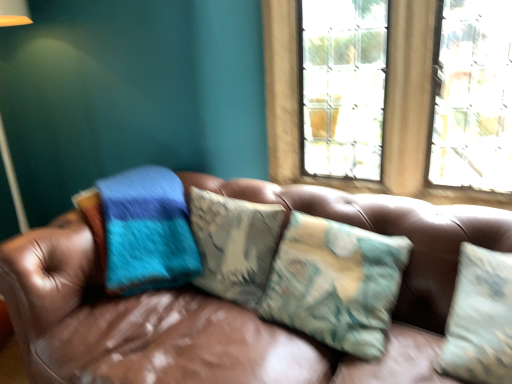
Question: From a real-world perspective, is camouflage fabric pillow at center on top of clear glass window at upper center?

Choices:
 (A) no
 (B) yes

Answer: (A)

Question: Can you confirm if camouflage fabric pillow at center is positioned to the left of clear glass window at upper center?

Choices:
 (A) yes
 (B) no

Answer: (A)

Question: Does camouflage fabric pillow at center have a larger size compared to clear glass window at upper center?

Choices:
 (A) no
 (B) yes

Answer: (A)

Question: Is camouflage fabric pillow at center positioned with its back to clear glass window at upper center?

Choices:
 (A) no
 (B) yes

Answer: (B)

Question: From the image's perspective, is camouflage fabric pillow at center located beneath clear glass window at upper center?

Choices:
 (A) yes
 (B) no

Answer: (A)

Question: Could you tell me if camouflage fabric pillow at center is facing clear glass window at upper center?

Choices:
 (A) no
 (B) yes

Answer: (A)

Question: Considering the relative positions of clear glass window at upper center and camouflage fabric pillow at center in the image provided, is clear glass window at upper center in front of camouflage fabric pillow at center?

Choices:
 (A) no
 (B) yes

Answer: (A)

Question: Is clear glass window at upper center shorter than camouflage fabric pillow at center?

Choices:
 (A) yes
 (B) no

Answer: (B)

Question: Does clear glass window at upper center have a greater width compared to camouflage fabric pillow at center?

Choices:
 (A) no
 (B) yes

Answer: (A)

Question: Is clear glass window at upper center taller than camouflage fabric pillow at center?

Choices:
 (A) yes
 (B) no

Answer: (A)

Question: Is clear glass window at upper center turned away from camouflage fabric pillow at center?

Choices:
 (A) no
 (B) yes

Answer: (A)

Question: Is clear glass window at upper center not within camouflage fabric pillow at center?

Choices:
 (A) no
 (B) yes

Answer: (B)

Question: Is camouflage fabric pillow at center positioned in front of brown leather couch at center?

Choices:
 (A) no
 (B) yes

Answer: (A)